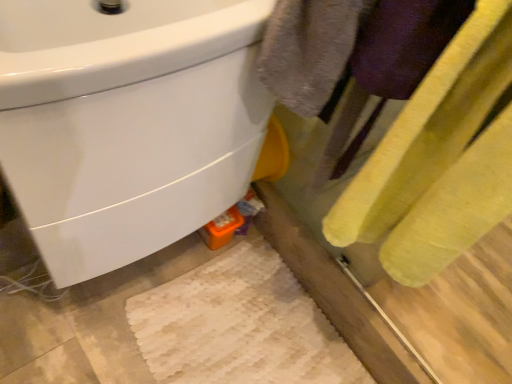
Question: Is white glossy sink at upper left bigger or smaller than yellow fabric towel at right?

Choices:
 (A) big
 (B) small

Answer: (A)

Question: Is white glossy sink at upper left wider or thinner than yellow fabric towel at right?

Choices:
 (A) wide
 (B) thin

Answer: (A)

Question: From a real-world perspective, relative to yellow fabric towel at right, is white glossy sink at upper left vertically above or below?

Choices:
 (A) below
 (B) above

Answer: (A)

Question: Relative to white glossy sink at upper left, is yellow fabric towel at right in front or behind?

Choices:
 (A) behind
 (B) front

Answer: (B)

Question: From the image's perspective, is yellow fabric towel at right located above or below white glossy sink at upper left?

Choices:
 (A) below
 (B) above

Answer: (A)

Question: In terms of height, does yellow fabric towel at right look taller or shorter compared to white glossy sink at upper left?

Choices:
 (A) short
 (B) tall

Answer: (B)

Question: Is point (486, 96) positioned closer to the camera than point (207, 167)?

Choices:
 (A) farther
 (B) closer

Answer: (B)